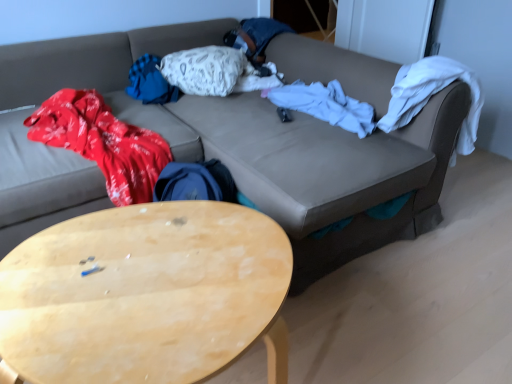
Question: Can you confirm if white soft blanket at center is shorter than leather couch at center?

Choices:
 (A) no
 (B) yes

Answer: (B)

Question: Considering the relative sizes of white soft blanket at center and leather couch at center in the image provided, is white soft blanket at center wider than leather couch at center?

Choices:
 (A) no
 (B) yes

Answer: (A)

Question: Can you confirm if white soft blanket at center is positioned to the left of leather couch at center?

Choices:
 (A) no
 (B) yes

Answer: (A)

Question: Can you confirm if white soft blanket at center is positioned to the right of leather couch at center?

Choices:
 (A) yes
 (B) no

Answer: (A)

Question: Does white soft blanket at center have a larger size compared to leather couch at center?

Choices:
 (A) yes
 (B) no

Answer: (B)

Question: Could you tell me if white soft blanket at center is turned towards leather couch at center?

Choices:
 (A) yes
 (B) no

Answer: (A)

Question: Is light wood/wooden coffee table at lower left positioned before white soft blanket at center?

Choices:
 (A) yes
 (B) no

Answer: (A)

Question: From a real-world perspective, is light wood/wooden coffee table at lower left physically above white soft blanket at center?

Choices:
 (A) yes
 (B) no

Answer: (B)

Question: Is light wood/wooden coffee table at lower left not close to white soft blanket at center?

Choices:
 (A) no
 (B) yes

Answer: (B)

Question: Is light wood/wooden coffee table at lower left beside white soft blanket at center?

Choices:
 (A) no
 (B) yes

Answer: (A)

Question: Would you say white soft blanket at center is part of light wood/wooden coffee table at lower left's contents?

Choices:
 (A) no
 (B) yes

Answer: (A)

Question: Considering the relative sizes of light wood/wooden coffee table at lower left and white soft blanket at center in the image provided, is light wood/wooden coffee table at lower left thinner than white soft blanket at center?

Choices:
 (A) no
 (B) yes

Answer: (A)

Question: Can you confirm if white soft blanket at center is wider than light wood/wooden coffee table at lower left?

Choices:
 (A) yes
 (B) no

Answer: (B)